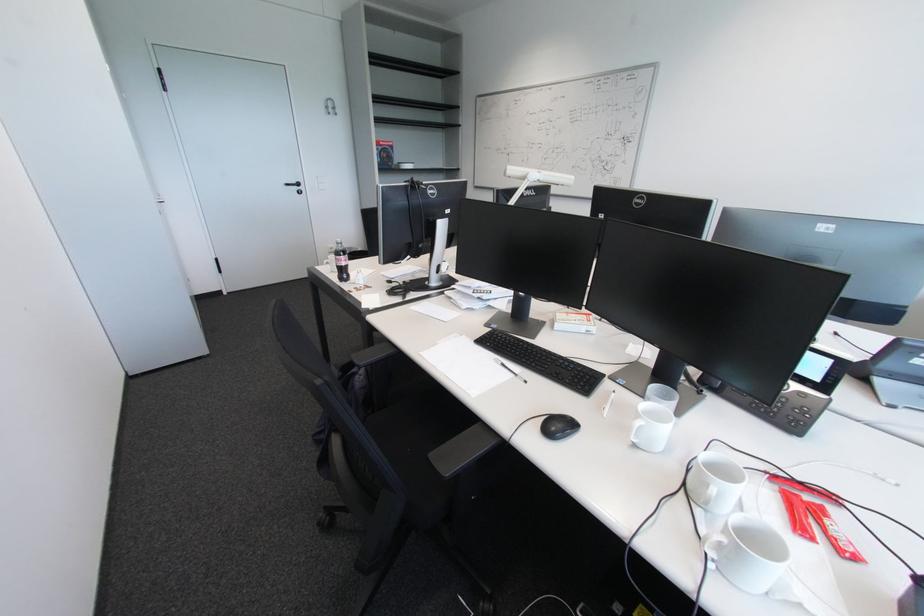
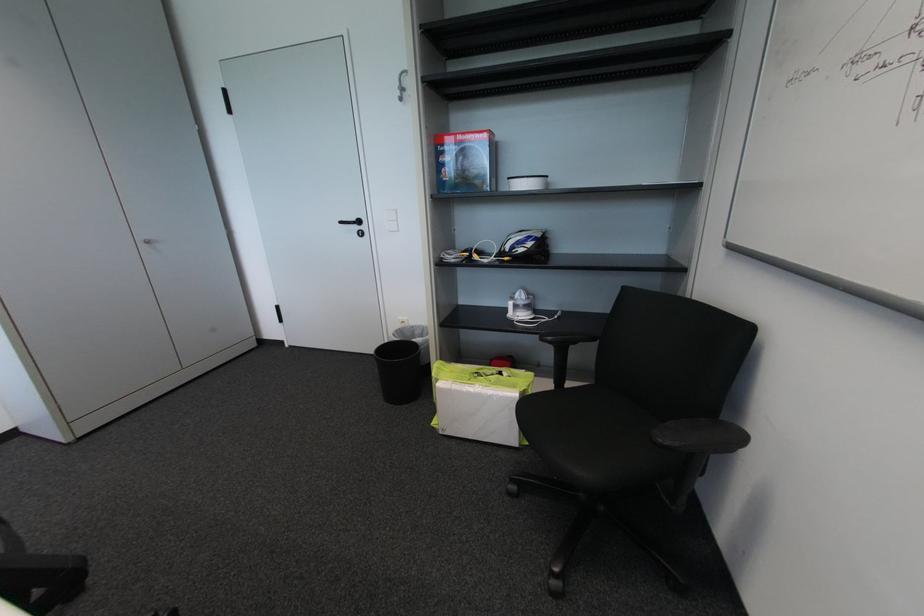
Find the pixel in the second image that matches (x=304, y=190) in the first image.

(362, 229)